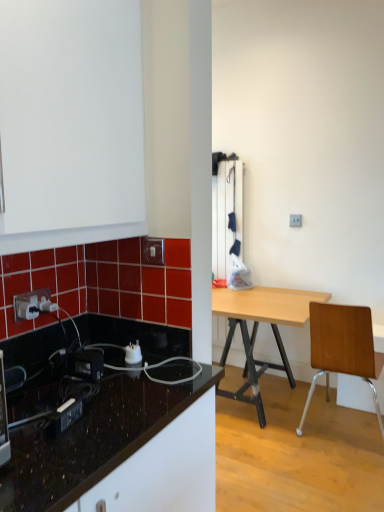
Identify the location of free point in front of brown wooden chair at right. (333, 477).